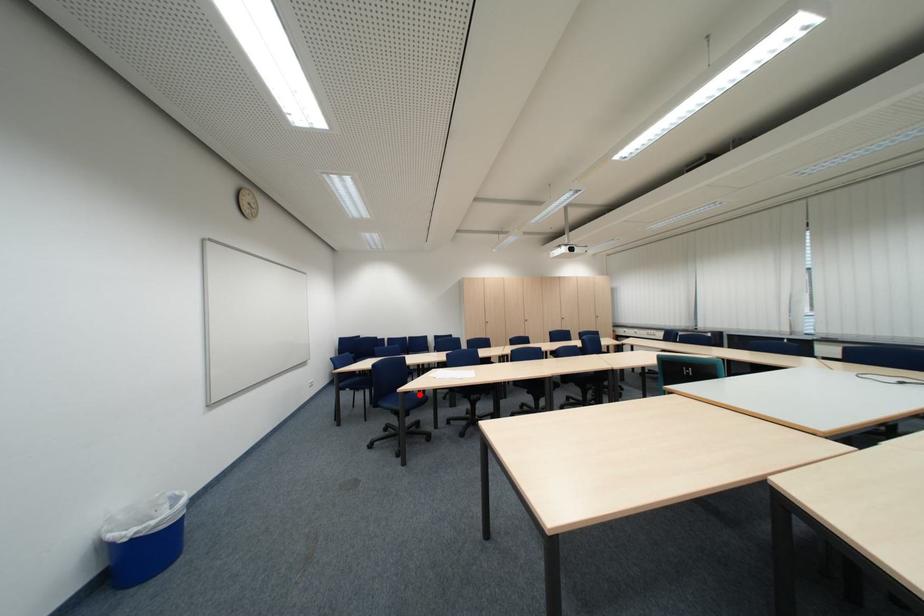
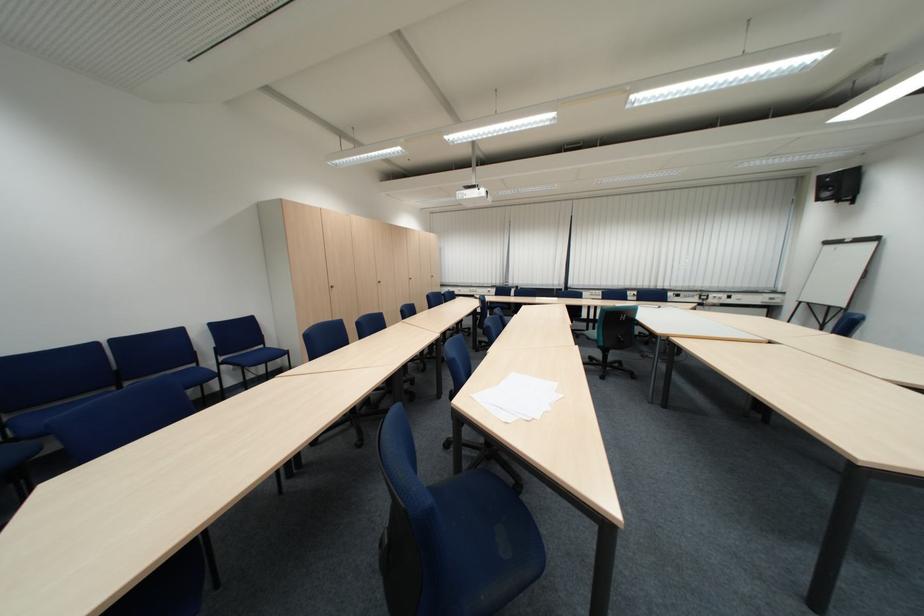
Question: I am providing you with two images of the same scene from different viewpoints. A red point is marked on the first image. Is the red point's position out of view in image 2?

Choices:
 (A) Yes
 (B) No

Answer: (A)